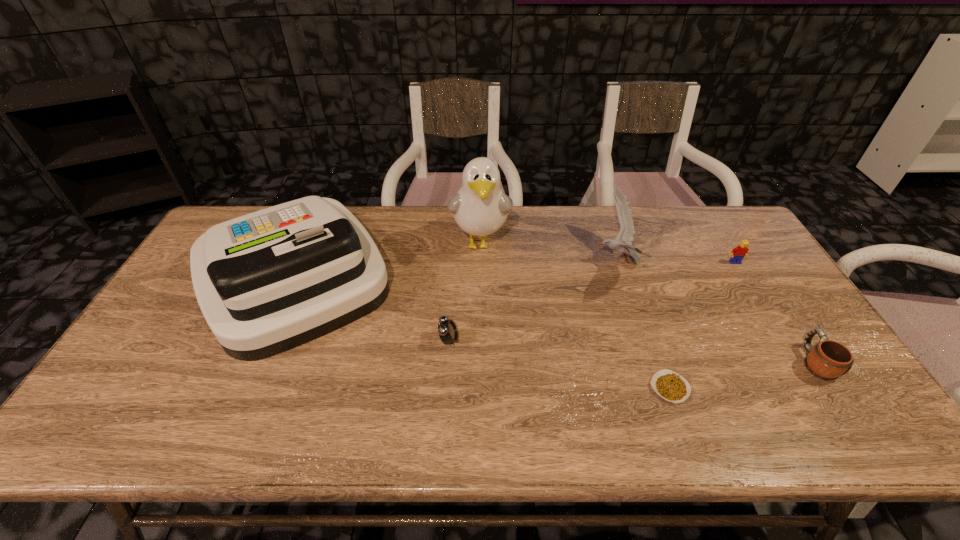
I want to click on vacant region located on the left of the legume, so click(510, 388).

Where is `cash register that is at the far edge`? The height and width of the screenshot is (540, 960). cash register that is at the far edge is located at coordinates (266, 282).

The height and width of the screenshot is (540, 960). What are the coordinates of `object located at the left edge` in the screenshot? It's located at (266, 282).

Identify the location of Lego situated at the right edge. The image size is (960, 540). (738, 253).

This screenshot has height=540, width=960. Identify the location of mug located at the right edge. (829, 360).

The height and width of the screenshot is (540, 960). Identify the location of object that is positioned at the far left corner. (266, 282).

Where is `vacant space at the far edge of the desktop`? This screenshot has width=960, height=540. vacant space at the far edge of the desktop is located at coordinates (469, 238).

At what (x,y) coordinates should I click in order to perform the action: click on free space at the near edge of the desktop. Please return your answer as a coordinate pair (x, y). Looking at the image, I should click on (637, 410).

At what (x,y) coordinates should I click in order to perform the action: click on vacant area at the far left corner. Please return your answer as a coordinate pair (x, y). Looking at the image, I should click on (256, 206).

In order to click on vacant region at the far right corner of the desktop in this screenshot , I will do `click(734, 233)`.